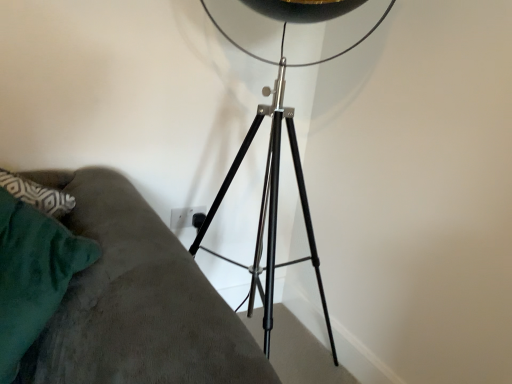
Measure the distance between velvet green pillow at left and camera.

The distance of velvet green pillow at left from camera is 74.15 centimeters.

Describe the element at coordinates (33, 275) in the screenshot. I see `velvet green pillow at left` at that location.

Where is `velvet green pillow at left`? The width and height of the screenshot is (512, 384). velvet green pillow at left is located at coordinates (33, 275).

Where is `velvet green pillow at left`? The height and width of the screenshot is (384, 512). velvet green pillow at left is located at coordinates (33, 275).